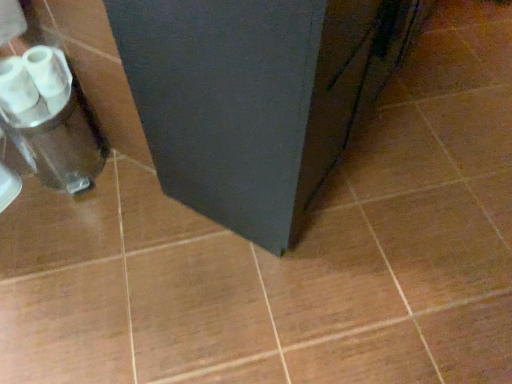
Question: From the image's perspective, is matte black cabinet at center positioned above or below white glossy toilet paper at left?

Choices:
 (A) below
 (B) above

Answer: (B)

Question: Is matte black cabinet at center situated inside white glossy toilet paper at left or outside?

Choices:
 (A) inside
 (B) outside

Answer: (B)

Question: Considering the real-world distances, which object is closest to the matte black cabinet at center?

Choices:
 (A) silver metallic blender at left
 (B) white glossy toilet paper at left

Answer: (A)

Question: Which object is the closest to the silver metallic blender at left?

Choices:
 (A) white glossy toilet paper at left
 (B) matte black cabinet at center

Answer: (A)